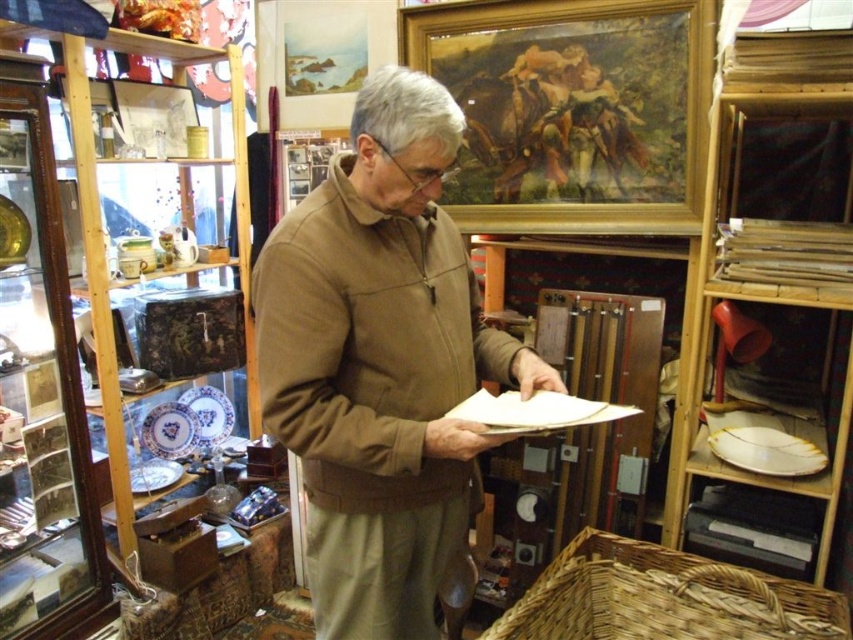
Question: Where is porcelain plate at center located in relation to porcelain plate at lower left in the image?

Choices:
 (A) left
 (B) right

Answer: (B)

Question: Considering the relative positions of white glossy plate at lower right and porcelain plate at center in the image provided, where is white glossy plate at lower right located with respect to porcelain plate at center?

Choices:
 (A) left
 (B) right

Answer: (B)

Question: Observing the image, what is the correct spatial positioning of white glossy plate at lower right in reference to porcelain plate at lower left?

Choices:
 (A) above
 (B) below

Answer: (A)

Question: Among these points, which one is farthest from the camera?

Choices:
 (A) (186, 406)
 (B) (216, 413)
 (C) (766, 429)

Answer: (B)

Question: Which object is farther from the camera taking this photo?

Choices:
 (A) brown soft jacket at center
 (B) porcelain plate at lower left
 (C) white glossy plate at lower right

Answer: (B)

Question: Estimate the real-world distances between objects in this image. Which object is farther from the blue porcelain plate at center?

Choices:
 (A) porcelain plate at lower left
 (B) brown soft jacket at center
 (C) white glossy plate at lower right
 (D) porcelain plate at center

Answer: (C)